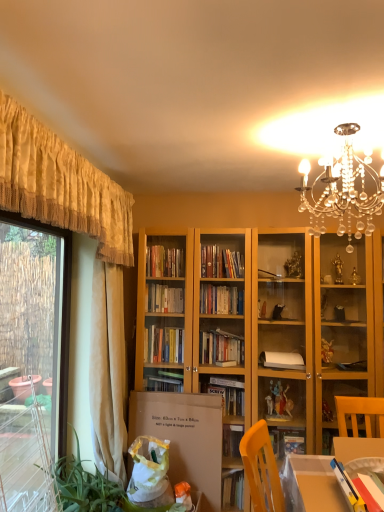
Question: Relative to transparent glass window at left, is beige fabric curtain at left, which ranks as the second curtain in front-to-back order, in front or behind?

Choices:
 (A) front
 (B) behind

Answer: (B)

Question: From the image's perspective, relative to transparent glass window at left, is beige fabric curtain at left, the first curtain from the back, above or below?

Choices:
 (A) below
 (B) above

Answer: (B)

Question: Which is farther from the green leafy plant at lower left?

Choices:
 (A) yellow fabric curtain at upper left, the first curtain viewed from the front
 (B) beige fabric curtain at left, the first curtain from the back
 (C) wooden table at lower right
 (D) cardboard box at lower left
 (E) clear crystal chandelier at upper center

Answer: (E)

Question: Which object is positioned closest to the beige fabric curtain at left, the first curtain from the back?

Choices:
 (A) transparent glass window at left
 (B) clear crystal chandelier at upper center
 (C) cardboard box at lower left
 (D) green leafy plant at lower left
 (E) wooden table at lower right

Answer: (D)